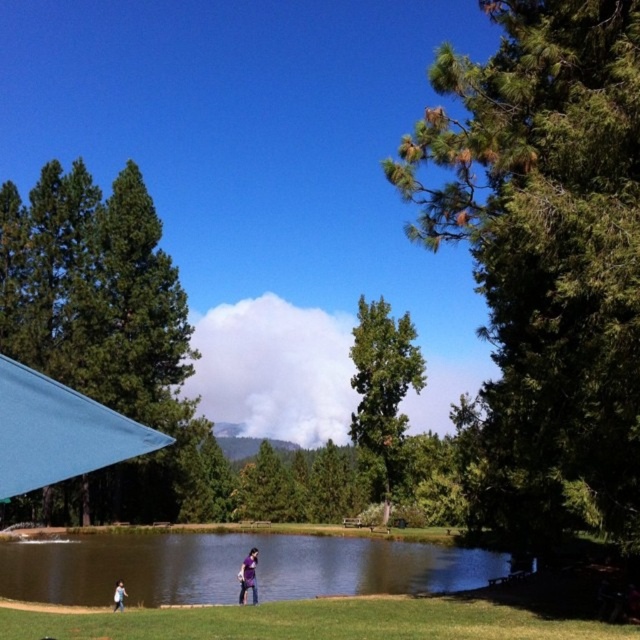
Question: Does green textured tree at right appear on the right side of green grass at lower center?

Choices:
 (A) yes
 (B) no

Answer: (A)

Question: Is green textured tree at right thinner than light blue jeans at lower left?

Choices:
 (A) no
 (B) yes

Answer: (A)

Question: Does green textured tree at right appear under green matte tree at upper left?

Choices:
 (A) yes
 (B) no

Answer: (B)

Question: Which object appears farthest from the camera in this image?

Choices:
 (A) dark blue jeans at lower center
 (B) green matte tree at upper left
 (C) green grass at lower center

Answer: (B)

Question: Which point appears farthest from the camera in this image?

Choices:
 (A) (250, 566)
 (B) (74, 536)
 (C) (301, 604)

Answer: (B)

Question: Estimate the real-world distances between objects in this image. Which object is farther from the green textured tree at right?

Choices:
 (A) green matte tree at upper left
 (B) green grass at lower center
 (C) green smooth water at center
 (D) dark blue jeans at lower center

Answer: (A)